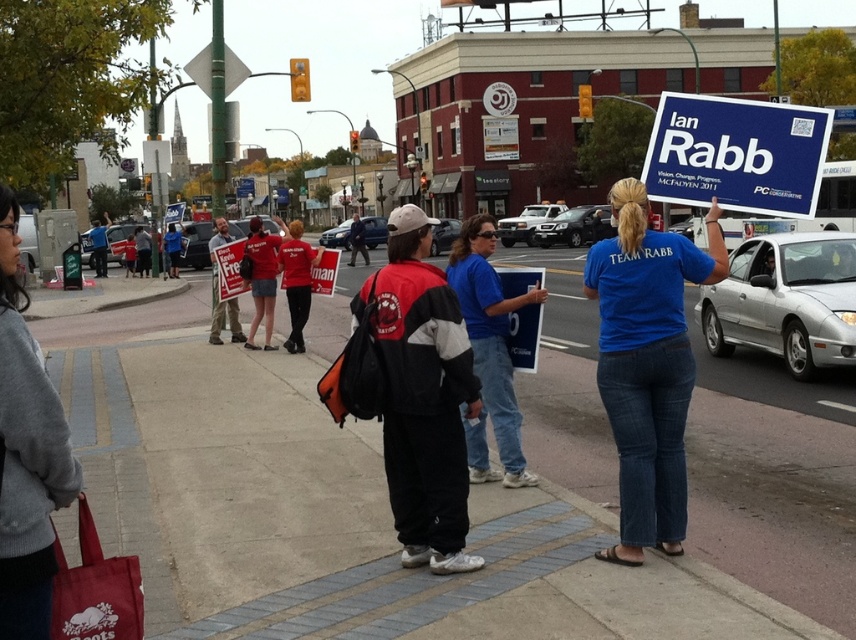
You are a photographer trying to capture a clear image of both the blue cardboard sign at upper right and the blue fabric sign at center. Which sign should you focus on first to ensure it appears larger in the photo?

The blue fabric sign at center should be focused on first because it occupies more space than the blue cardboard sign at upper right, making it naturally appear larger in the photo.

You are a photographer at the event and want to capture both the blue cotton shirt at center and the blue fabric sign at center in a single frame. Based on their positions, which object should you focus on first to ensure both are in the shot?

The blue cotton shirt at center is to the right of the blue fabric sign at center, so focusing on the blue fabric sign at center first would allow you to frame the shot to include both objects since the shirt is positioned to the right of the sign.